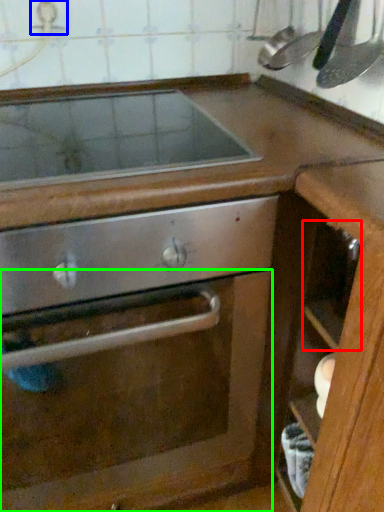
Question: Based on their relative distances, which object is farther from drawer (highlighted by a red box)? Choose from faucet (highlighted by a blue box) and glass door (highlighted by a green box).

Choices:
 (A) faucet
 (B) glass door

Answer: (A)